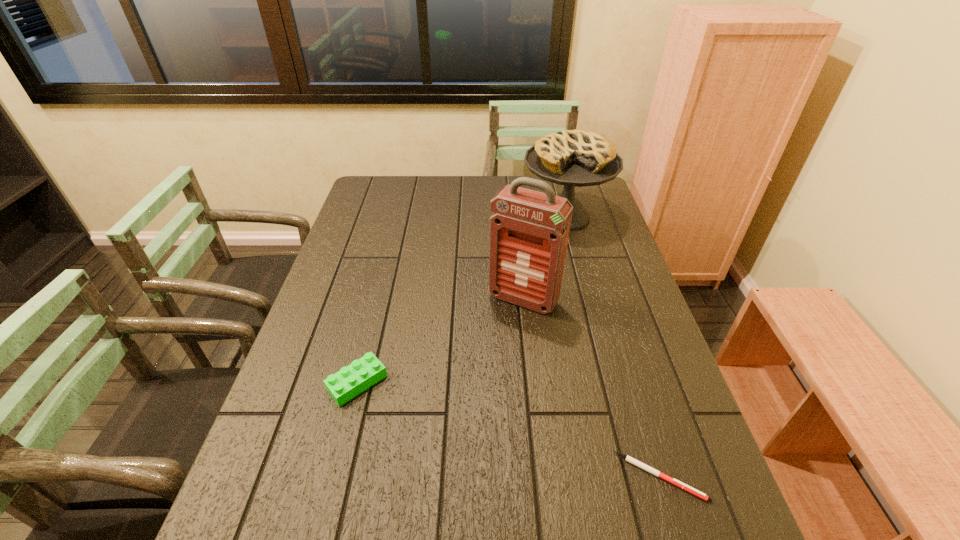
Identify the location of free space on the desktop that is between the second shortest object and the shortest object and is positioned on the front-facing side of the first-aid kit. (455, 413).

The height and width of the screenshot is (540, 960). What are the coordinates of `vacant space on the desktop that is between the third farthest object and the shortest object and is positioned on the cut side of the third shortest object` in the screenshot? It's located at pos(464,416).